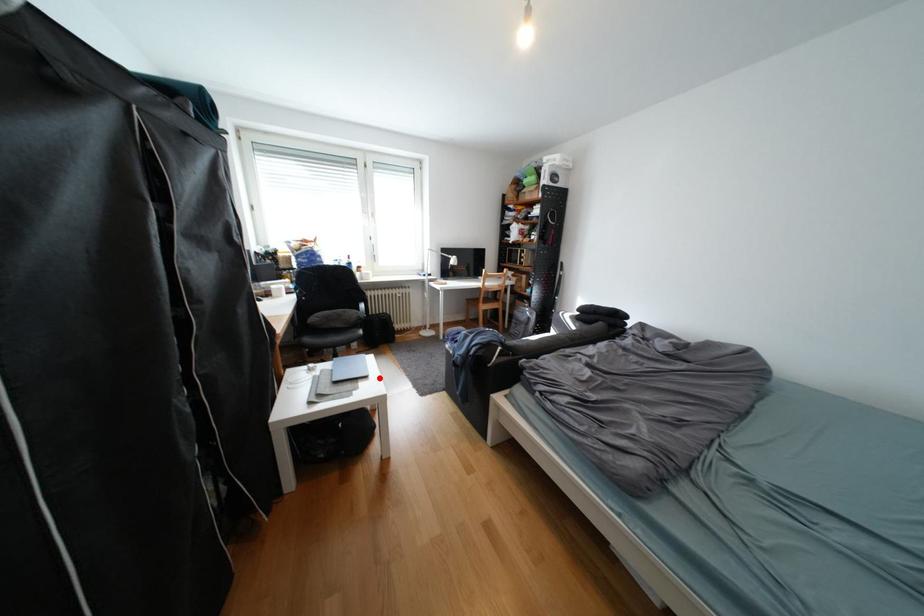
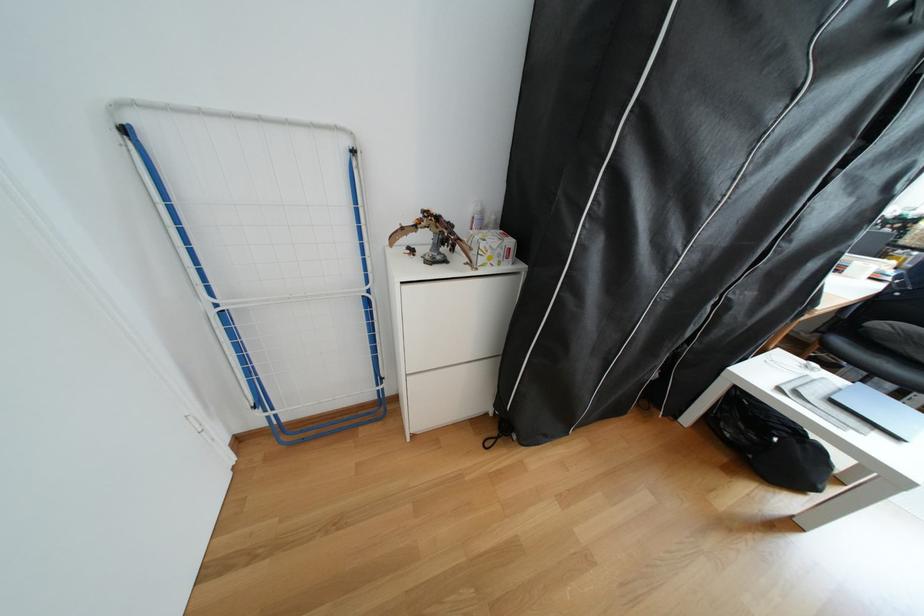
Where in the second image is the point corresponding to the highlighted location from the first image?

(908, 439)